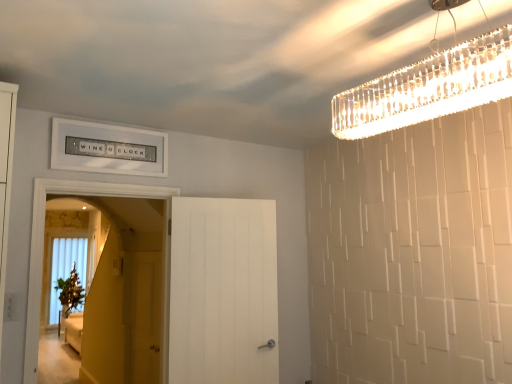
What is the approximate width of clear crystal chandelier at upper right?

The width of clear crystal chandelier at upper right is 21.67 centimeters.

The width and height of the screenshot is (512, 384). Identify the location of white wooden door at left, the 2th door from the right. 42,243.

Considering the sizes of objects matte yellow screen door at center and clear crystal chandelier at upper right in the image provided, who is taller, matte yellow screen door at center or clear crystal chandelier at upper right?

With more height is matte yellow screen door at center.

Could you tell me if matte yellow screen door at center is turned towards clear crystal chandelier at upper right?

No, matte yellow screen door at center is not facing towards clear crystal chandelier at upper right.

From the image's perspective, is matte yellow screen door at center located above clear crystal chandelier at upper right?

No, from the image's perspective, matte yellow screen door at center is not above clear crystal chandelier at upper right.

Is matte yellow screen door at center next to clear crystal chandelier at upper right?

No, matte yellow screen door at center is not with clear crystal chandelier at upper right.

Is point (30, 383) closer to camera compared to point (501, 43)?

No, (30, 383) is behind (501, 43).

Which object is positioned more to the left, white wooden door at left, the 2th door from the right, or clear crystal chandelier at upper right?

From the viewer's perspective, white wooden door at left, the 2th door from the right, appears more on the left side.

Is white wooden door at left, the 2th door from the right, facing towards clear crystal chandelier at upper right?

Yes, white wooden door at left, the 2th door from the right, is turned towards clear crystal chandelier at upper right.

Is clear crystal chandelier at upper right placed right next to white wooden door at left, which is counted as the 1th door, starting from the left?

No, clear crystal chandelier at upper right is not touching white wooden door at left, which is counted as the 1th door, starting from the left.

This screenshot has width=512, height=384. Identify the location of door that is the 2nd one when counting leftward from the clear crystal chandelier at upper right. (42, 243).

Who is shorter, clear crystal chandelier at upper right or white wooden door at left, the 2th door from the right?

Standing shorter between the two is clear crystal chandelier at upper right.

From the image's perspective, is clear crystal chandelier at upper right positioned above or below white wooden door at left, the 2th door from the right?

clear crystal chandelier at upper right is situated higher than white wooden door at left, the 2th door from the right, in the image.

Could you measure the distance between white wooden door at left, the 2th door from the right, and matte yellow screen door at center?

The distance of white wooden door at left, the 2th door from the right, from matte yellow screen door at center is 1.04 meters.

In the scene shown: Which is more distant, (137, 190) or (139, 307)?

The point (139, 307) is farther from the camera.

Which of these two, white wooden door at left, the 2th door from the right, or matte yellow screen door at center, is bigger?

white wooden door at left, the 2th door from the right.

I want to click on the 1st door counting from the right side of the matte yellow screen door at center, so click(x=42, y=243).

Is white wooden door at left, which is counted as the 1th door, starting from the left, inside the boundaries of white matte door at center, positioned as the 1th door in right-to-left order, or outside?

white wooden door at left, which is counted as the 1th door, starting from the left, cannot be found inside white matte door at center, positioned as the 1th door in right-to-left order.

From the image's perspective, between white wooden door at left, which is counted as the 1th door, starting from the left, and white matte door at center, positioned as the 1th door in right-to-left order, which one is located above?

white wooden door at left, which is counted as the 1th door, starting from the left.

Can you confirm if white wooden door at left, which is counted as the 1th door, starting from the left, is positioned to the right of white matte door at center, positioned as the 1th door in right-to-left order?

No.

Considering the positions of points (38, 278) and (193, 306), is point (38, 278) farther from camera compared to point (193, 306)?

No, it is not.

From the image's perspective, is matte yellow screen door at center beneath white wooden door at left, which is counted as the 1th door, starting from the left?

Correct, matte yellow screen door at center appears lower than white wooden door at left, which is counted as the 1th door, starting from the left, in the image.

Considering the positions of objects matte yellow screen door at center and white wooden door at left, which is counted as the 1th door, starting from the left, in the image provided, who is more to the left, matte yellow screen door at center or white wooden door at left, which is counted as the 1th door, starting from the left,?

Positioned to the left is matte yellow screen door at center.

Is matte yellow screen door at center not close to white wooden door at left, which is counted as the 1th door, starting from the left?

Indeed, matte yellow screen door at center is not near white wooden door at left, which is counted as the 1th door, starting from the left.

Considering the sizes of objects matte yellow screen door at center and white wooden door at left, which is counted as the 1th door, starting from the left, in the image provided, who is shorter, matte yellow screen door at center or white wooden door at left, which is counted as the 1th door, starting from the left,?

matte yellow screen door at center.

Is point (126, 322) farther from camera compared to point (183, 217)?

Yes, point (126, 322) is farther from viewer.

Based on the photo, which of these two, matte yellow screen door at center or white matte door at center, the 2th door positioned from the left, is thinner?

matte yellow screen door at center.

At what (x,y) coordinates should I click in order to perform the action: click on light fixture located above the matte yellow screen door at center (from the image's perspective). Please return your answer as a coordinate pair (x, y). Image resolution: width=512 pixels, height=384 pixels. Looking at the image, I should click on (428, 88).

From the image's perspective, which door is the 1st one below the clear crystal chandelier at upper right? Please provide its 2D coordinates.

[(42, 243)]

When comparing their distances from clear crystal chandelier at upper right, does matte yellow screen door at center or white matte door at center, the 2th door positioned from the left, seem further?

matte yellow screen door at center is positioned further to the anchor clear crystal chandelier at upper right.

Which object lies nearer to the anchor point white wooden door at left, which is counted as the 1th door, starting from the left, white matte door at center, positioned as the 1th door in right-to-left order, or matte yellow screen door at center?

white matte door at center, positioned as the 1th door in right-to-left order.

When comparing their distances from matte yellow screen door at center, does clear crystal chandelier at upper right or white matte door at center, the 2th door positioned from the left, seem further?

→ clear crystal chandelier at upper right is positioned further to the anchor matte yellow screen door at center.

Which object lies nearer to the anchor point matte yellow screen door at center, white wooden door at left, the 2th door from the right, or clear crystal chandelier at upper right?

Among the two, white wooden door at left, the 2th door from the right, is located nearer to matte yellow screen door at center.

Which object lies nearer to the anchor point matte yellow screen door at center, white matte door at center, the 2th door positioned from the left, or clear crystal chandelier at upper right?

white matte door at center, the 2th door positioned from the left, lies closer to matte yellow screen door at center than the other object.

Which object lies nearer to the anchor point clear crystal chandelier at upper right, matte yellow screen door at center or white wooden door at left, which is counted as the 1th door, starting from the left?

Among the two, white wooden door at left, which is counted as the 1th door, starting from the left, is located nearer to clear crystal chandelier at upper right.

Based on their spatial positions, is white matte door at center, positioned as the 1th door in right-to-left order, or white wooden door at left, which is counted as the 1th door, starting from the left, further from matte yellow screen door at center?

The object further to matte yellow screen door at center is white wooden door at left, which is counted as the 1th door, starting from the left.

When comparing their distances from white wooden door at left, which is counted as the 1th door, starting from the left, does white matte door at center, the 2th door positioned from the left, or clear crystal chandelier at upper right seem closer?

The object closer to white wooden door at left, which is counted as the 1th door, starting from the left, is white matte door at center, the 2th door positioned from the left.

Find the location of a particular element. The image size is (512, 384). door between clear crystal chandelier at upper right and white matte door at center, the 2th door positioned from the left, in the front-back direction is located at coordinates (42, 243).

Find the location of a particular element. door between white wooden door at left, the 2th door from the right, and matte yellow screen door at center from front to back is located at coordinates (223, 291).